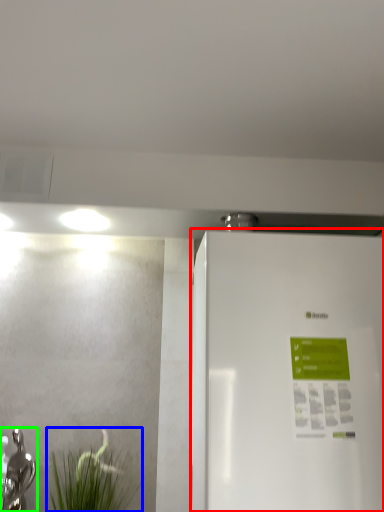
Question: Considering the real-world distances, which object is farthest from refrigerator (highlighted by a red box)? plant (highlighted by a blue box) or tap (highlighted by a green box)?

Choices:
 (A) plant
 (B) tap

Answer: (B)